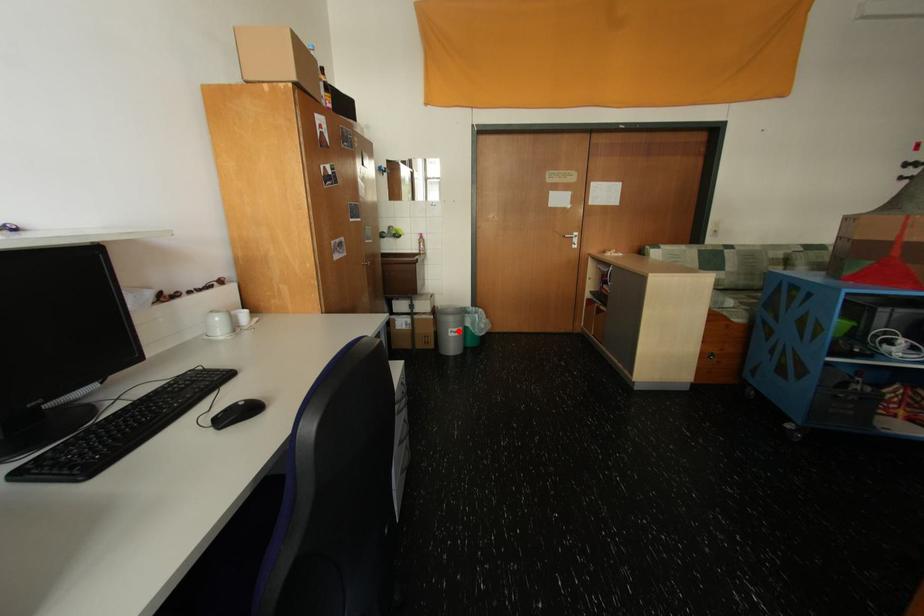
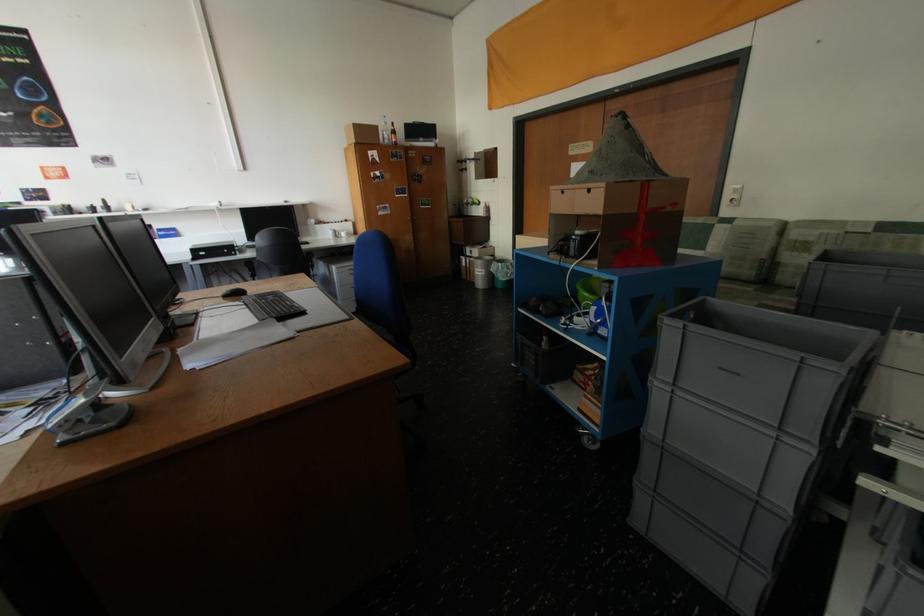
Find the pixel in the second image that matches the highlighted location in the first image.

(484, 270)